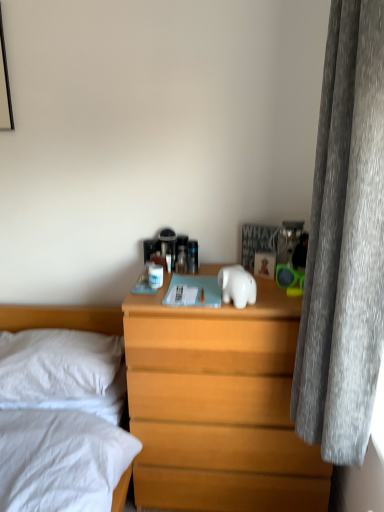
You are a GUI agent. You are given a task and a screenshot of the screen. Output one action in this format:
    pyautogui.click(x=<x>, y=<y>)
    Task: Click on the free spot to the right of white glossy elephant at center
    The image size is (384, 512).
    Given the screenshot: What is the action you would take?
    pyautogui.click(x=270, y=302)